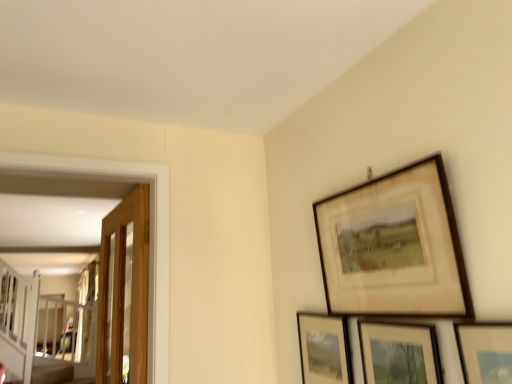
Measure the distance between point (413,379) and camera.

The distance of point (413,379) from camera is 38.15 inches.

What are the coordinates of `matte black picture frame at lower right, the 4th picture frame positioned from the front` in the screenshot? It's located at (324, 348).

Find the location of a particular element. The height and width of the screenshot is (384, 512). matte wooden picture frame at lower right, positioned as the 2th picture frame in back-to-front order is located at coordinates (399, 353).

In the scene shown: Considering the relative sizes of matte wooden picture frame at lower right, positioned as the 2th picture frame in back-to-front order, and wooden glass door at left in the image provided, is matte wooden picture frame at lower right, positioned as the 2th picture frame in back-to-front order, smaller than wooden glass door at left?

Yes.

Could wooden glass door at left be considered to be inside matte wooden picture frame at lower right, positioned as the 2th picture frame in back-to-front order?

No, wooden glass door at left is located outside of matte wooden picture frame at lower right, positioned as the 2th picture frame in back-to-front order.

Based on the photo, from a real-world perspective, between matte wooden picture frame at lower right, positioned as the 2th picture frame in back-to-front order, and wooden glass door at left, who is vertically higher?

In real-world perspective, wooden glass door at left is above.

Is matte wooden picture frame at lower right, which is the 3th picture frame in front-to-back order, directly adjacent to wooden glass door at left?

No, matte wooden picture frame at lower right, which is the 3th picture frame in front-to-back order, is not in contact with wooden glass door at left.

Is matte wooden picture frame at lower right, the 4th picture frame viewed from the back, placed right next to matte black picture frame at lower right, acting as the first picture frame starting from the back?

No, matte wooden picture frame at lower right, the 4th picture frame viewed from the back, is not beside matte black picture frame at lower right, acting as the first picture frame starting from the back.

Between matte wooden picture frame at lower right, the 4th picture frame viewed from the back, and matte black picture frame at lower right, acting as the first picture frame starting from the back, which one has less height?

matte wooden picture frame at lower right, the 4th picture frame viewed from the back.

How distant is matte wooden picture frame at lower right, the first picture frame viewed from the front, from matte black picture frame at lower right, acting as the first picture frame starting from the back?

18.59 inches.

Is matte wooden picture frame at lower right, the 4th picture frame viewed from the back, facing away from matte black picture frame at lower right, the 4th picture frame positioned from the front?

No.

Which is behind, matte wooden picture frame at lower right, positioned as the 2th picture frame in back-to-front order, or matte black picture frame at lower right, the 4th picture frame positioned from the front?

matte black picture frame at lower right, the 4th picture frame positioned from the front, is behind.

At what (x,y) coordinates should I click in order to perform the action: click on picture frame that is the 2nd object directly below the matte black picture frame at lower right, acting as the first picture frame starting from the back (from a real-world perspective). Please return your answer as a coordinate pair (x, y). The image size is (512, 384). Looking at the image, I should click on (399, 353).

Are matte wooden picture frame at lower right, which is the 3th picture frame in front-to-back order, and matte black picture frame at lower right, acting as the first picture frame starting from the back, beside each other?

No, matte wooden picture frame at lower right, which is the 3th picture frame in front-to-back order, is not with matte black picture frame at lower right, acting as the first picture frame starting from the back.

Which object is thinner, matte wooden picture frame at lower right, positioned as the 2th picture frame in back-to-front order, or matte black picture frame at lower right, acting as the first picture frame starting from the back?

matte black picture frame at lower right, acting as the first picture frame starting from the back.

Does wooden picture frame at upper right, the third picture frame when ordered from back to front, have a larger size compared to wooden glass door at left?

Incorrect, wooden picture frame at upper right, the third picture frame when ordered from back to front, is not larger than wooden glass door at left.

Which object is wider, wooden picture frame at upper right, the third picture frame when ordered from back to front, or wooden glass door at left?

With larger width is wooden glass door at left.

How much distance is there between wooden picture frame at upper right, which is counted as the second picture frame, starting from the front, and wooden glass door at left?

wooden picture frame at upper right, which is counted as the second picture frame, starting from the front, and wooden glass door at left are 34.54 inches apart from each other.

What's the angular difference between wooden picture frame at upper right, the third picture frame when ordered from back to front, and wooden glass door at left's facing directions?

0.623 degrees separate the facing orientations of wooden picture frame at upper right, the third picture frame when ordered from back to front, and wooden glass door at left.

From a real-world perspective, which object stands above the other?

From a 3D spatial view, wooden glass door at left is above.

From a real-world perspective, starting from the wooden glass door at left, which picture frame is the 2nd one below it? Please provide its 2D coordinates.

[(485, 351)]

From the image's perspective, does matte wooden picture frame at lower right, the first picture frame viewed from the front, appear lower than wooden glass door at left?

Actually, matte wooden picture frame at lower right, the first picture frame viewed from the front, appears above wooden glass door at left in the image.

Is wooden glass door at left smaller than matte wooden picture frame at lower right, the 4th picture frame viewed from the back?

No, wooden glass door at left is not smaller than matte wooden picture frame at lower right, the 4th picture frame viewed from the back.

Is wooden glass door at left to the left or to the right of matte wooden picture frame at lower right, the 4th picture frame viewed from the back, in the image?

Clearly, wooden glass door at left is on the left of matte wooden picture frame at lower right, the 4th picture frame viewed from the back, in the image.

Is point (133, 287) more distant than point (477, 326)?

Yes, it is.

Is wooden glass door at left thinner than matte wooden picture frame at lower right, the first picture frame viewed from the front?

In fact, wooden glass door at left might be wider than matte wooden picture frame at lower right, the first picture frame viewed from the front.

Which object is more forward, wooden glass door at left or matte black picture frame at lower right, the 4th picture frame positioned from the front?

matte black picture frame at lower right, the 4th picture frame positioned from the front, is closer to the camera.

From a real-world perspective, who is located lower, wooden glass door at left or matte black picture frame at lower right, the 4th picture frame positioned from the front?

matte black picture frame at lower right, the 4th picture frame positioned from the front, is physically lower.

From the image's perspective, is wooden glass door at left located above or below matte black picture frame at lower right, acting as the first picture frame starting from the back?

wooden glass door at left is above matte black picture frame at lower right, acting as the first picture frame starting from the back.

Identify the location of the 3rd picture frame located beneath the wooden glass door at left (from a real-world perspective). (x=399, y=353).

Which picture frame is the 3rd one when counting from the left side of the matte wooden picture frame at lower right, the 4th picture frame viewed from the back? Please provide its 2D coordinates.

[(324, 348)]

In the scene shown: Estimate the real-world distances between objects in this image. Which object is further from matte wooden picture frame at lower right, which is the 3th picture frame in front-to-back order, matte black picture frame at lower right, acting as the first picture frame starting from the back, or wooden picture frame at upper right, the third picture frame when ordered from back to front?

matte black picture frame at lower right, acting as the first picture frame starting from the back, lies further to matte wooden picture frame at lower right, which is the 3th picture frame in front-to-back order, than the other object.

Based on their spatial positions, is wooden picture frame at upper right, which is counted as the second picture frame, starting from the front, or matte black picture frame at lower right, acting as the first picture frame starting from the back, closer to wooden glass door at left?

matte black picture frame at lower right, acting as the first picture frame starting from the back, is closer to wooden glass door at left.

From the picture: Looking at the image, which one is located closer to wooden picture frame at upper right, the third picture frame when ordered from back to front, matte wooden picture frame at lower right, which is the 3th picture frame in front-to-back order, or matte black picture frame at lower right, acting as the first picture frame starting from the back?

matte wooden picture frame at lower right, which is the 3th picture frame in front-to-back order, lies closer to wooden picture frame at upper right, the third picture frame when ordered from back to front, than the other object.

Looking at the image, which one is located further to wooden picture frame at upper right, the third picture frame when ordered from back to front, matte wooden picture frame at lower right, which is the 3th picture frame in front-to-back order, or wooden glass door at left?

The object further to wooden picture frame at upper right, the third picture frame when ordered from back to front, is wooden glass door at left.

Considering their positions, is matte wooden picture frame at lower right, the 4th picture frame viewed from the back, positioned further to matte black picture frame at lower right, acting as the first picture frame starting from the back, than matte wooden picture frame at lower right, which is the 3th picture frame in front-to-back order?

matte wooden picture frame at lower right, the 4th picture frame viewed from the back.

From the image, which object appears to be farther from wooden glass door at left, wooden picture frame at upper right, the third picture frame when ordered from back to front, or matte wooden picture frame at lower right, which is the 3th picture frame in front-to-back order?

Among the two, matte wooden picture frame at lower right, which is the 3th picture frame in front-to-back order, is located further to wooden glass door at left.

From the picture: Based on their spatial positions, is wooden picture frame at upper right, the third picture frame when ordered from back to front, or wooden glass door at left further from matte wooden picture frame at lower right, the first picture frame viewed from the front?

wooden glass door at left lies further to matte wooden picture frame at lower right, the first picture frame viewed from the front, than the other object.

Based on their spatial positions, is wooden glass door at left or matte black picture frame at lower right, acting as the first picture frame starting from the back, closer to matte wooden picture frame at lower right, positioned as the 2th picture frame in back-to-front order?

The object closer to matte wooden picture frame at lower right, positioned as the 2th picture frame in back-to-front order, is matte black picture frame at lower right, acting as the first picture frame starting from the back.

Identify the location of picture frame between wooden glass door at left and wooden picture frame at upper right, which is counted as the second picture frame, starting from the front, from left to right. (324, 348).

The height and width of the screenshot is (384, 512). I want to click on picture frame between wooden picture frame at upper right, which is counted as the second picture frame, starting from the front, and matte wooden picture frame at lower right, which is the 3th picture frame in front-to-back order, in the vertical direction, so click(485, 351).